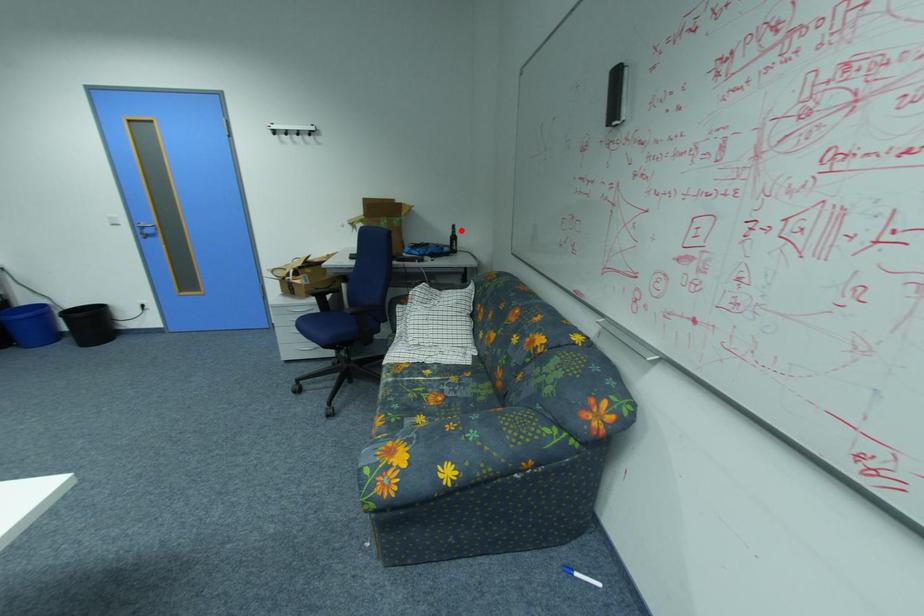
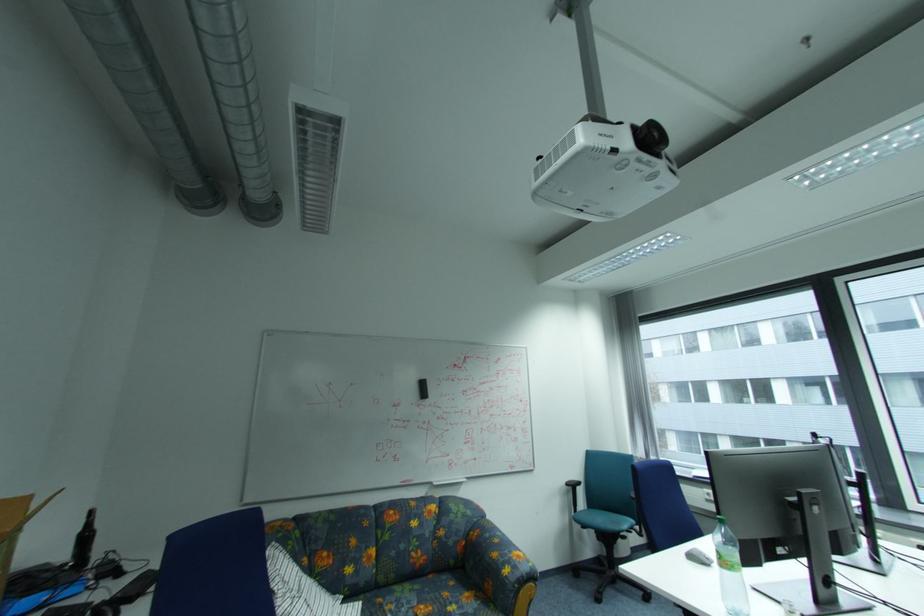
The point at the highlighted location is marked in the first image. Where is the corresponding point in the second image?

(93, 522)